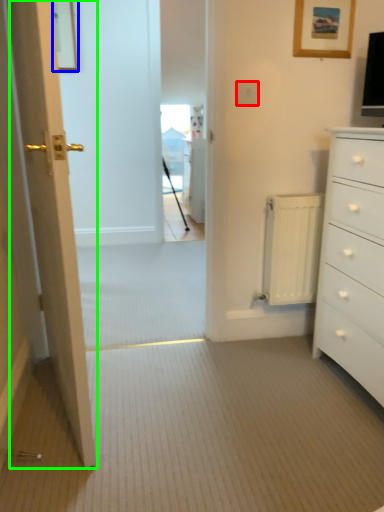
Question: Considering the real-world distances, which object is farthest from electric outlet (highlighted by a red box)? picture frame (highlighted by a blue box) or door (highlighted by a green box)?

Choices:
 (A) picture frame
 (B) door

Answer: (A)